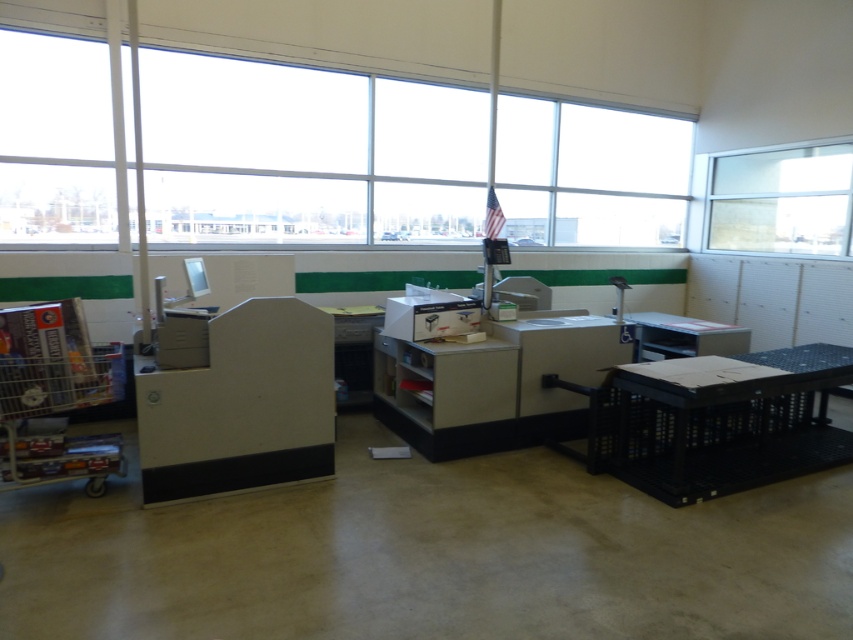
You are setting up a presentation and need to choose between using the transparent glass window at upper center or the matte gray table at right as a backdrop. Which option provides a wider surface area for your setup?

The transparent glass window at upper center has a larger width than the matte gray table at right, so it provides a wider surface area for your setup.

You are an office worker who wants to see outside while working. You have a choice between sitting near the transparent glass window at upper center or the matte gray table at right. Which option allows you to have a taller view of the outside?

The transparent glass window at upper center is much taller than the matte gray table at right, so sitting near the transparent glass window at upper center allows you to have a taller view of the outside.